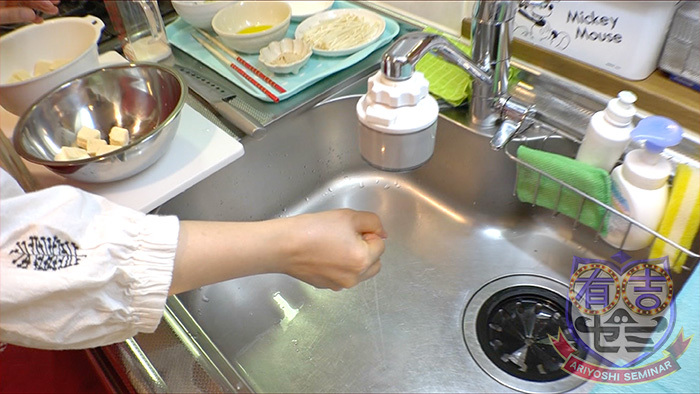
I want to click on chopping board, so click(210, 157).